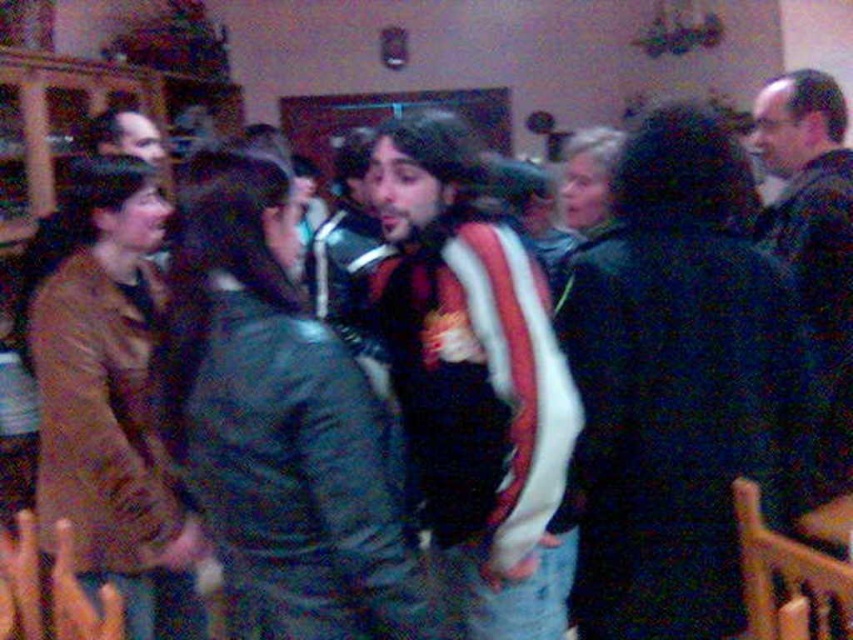
The width and height of the screenshot is (853, 640). What do you see at coordinates (476, 381) in the screenshot?
I see `striped sweater at center` at bounding box center [476, 381].

Does striped sweater at center appear on the left side of dark green sweater at center?

Correct, you'll find striped sweater at center to the left of dark green sweater at center.

Is point (381, 308) positioned before point (840, 209)?

Yes, point (381, 308) is closer to viewer.

Identify the location of striped sweater at center. This screenshot has height=640, width=853. (476, 381).